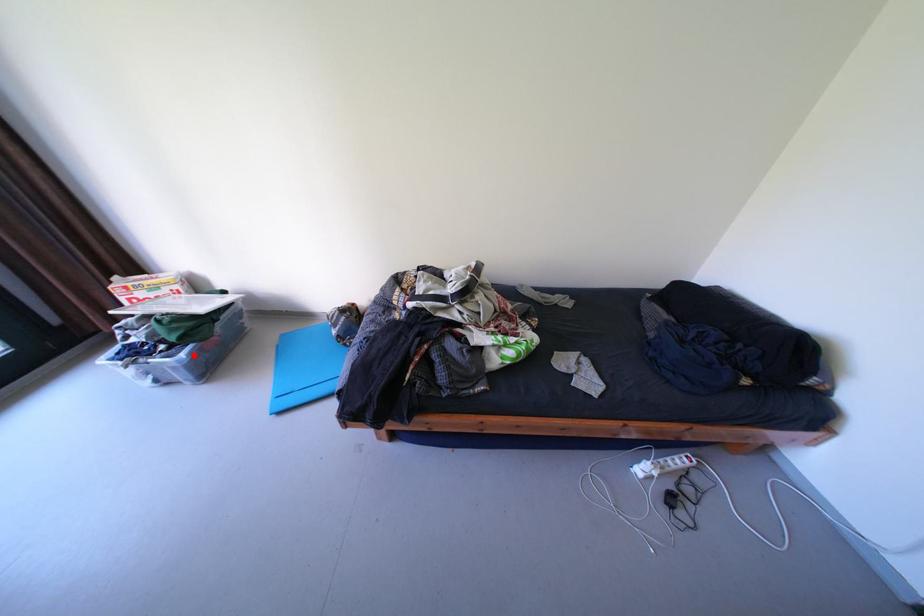
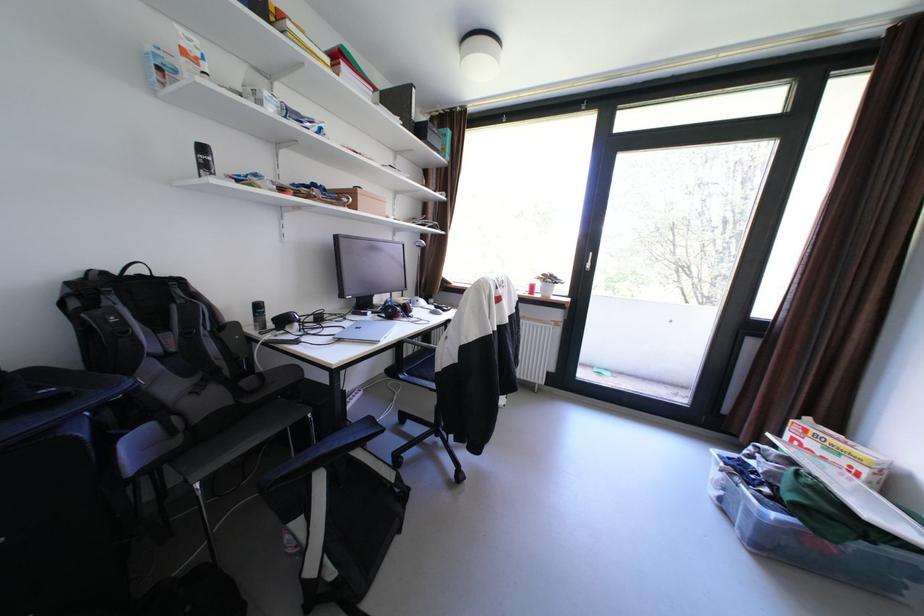
Locate, in the second image, the point that corresponds to the highlighted location in the first image.

(784, 516)